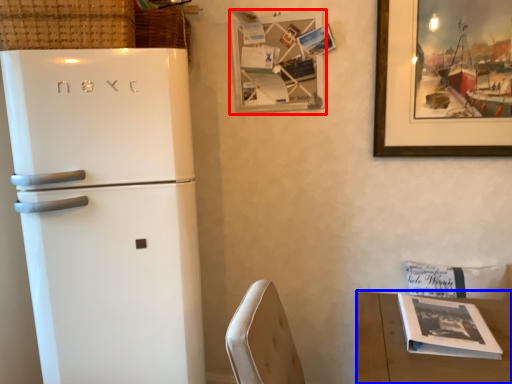
Question: Which object appears farthest to the camera in this image, picture frame (highlighted by a red box) or table (highlighted by a blue box)?

Choices:
 (A) picture frame
 (B) table

Answer: (A)